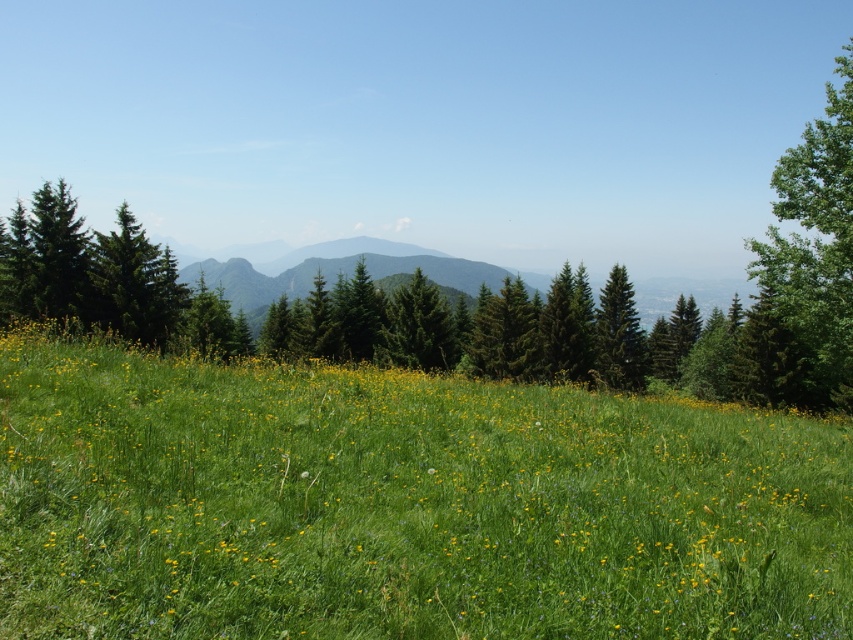
Question: Is green grass at center to the right of green matte tree at left from the viewer's perspective?

Choices:
 (A) yes
 (B) no

Answer: (A)

Question: Which point appears farthest from the camera in this image?

Choices:
 (A) (161, 326)
 (B) (415, 292)
 (C) (843, 332)

Answer: (B)

Question: Can you confirm if green matte tree at left is positioned to the left of green matte tree at right?

Choices:
 (A) no
 (B) yes

Answer: (B)

Question: Which object is closer to the camera taking this photo?

Choices:
 (A) green leafy tree at right
 (B) green matte tree at right
 (C) green matte tree at center

Answer: (A)

Question: Among these objects, which one is farthest from the camera?

Choices:
 (A) green grass at center
 (B) green matte tree at left
 (C) green leafy tree at right

Answer: (B)

Question: Can you confirm if green grass at center is smaller than green matte tree at left?

Choices:
 (A) yes
 (B) no

Answer: (A)